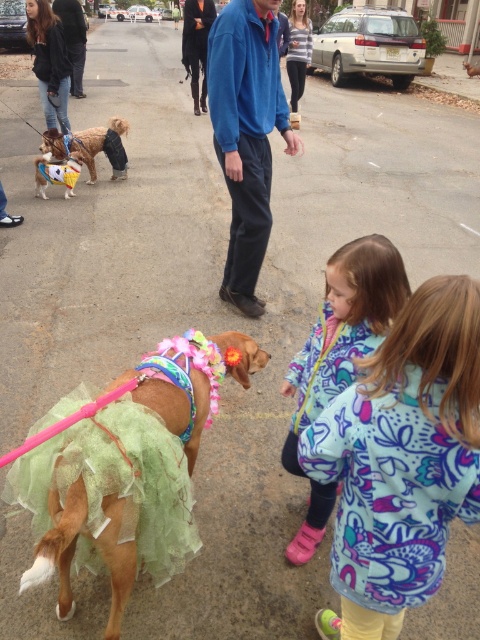
Question: Based on their relative distances, which object is nearer to the shiny gold dog at center?

Choices:
 (A) brown plush dog at left
 (B) striped fabric shirt at center
 (C) printed fleece jacket at lower right

Answer: (A)

Question: Can you confirm if printed fleece jacket at lower right is positioned to the right of fluffy fleece jacket at lower right?

Choices:
 (A) no
 (B) yes

Answer: (B)

Question: Can you confirm if printed fleece jacket at lower right is thinner than shiny green tulle skirt at center?

Choices:
 (A) yes
 (B) no

Answer: (A)

Question: Which object is farther from the camera taking this photo?

Choices:
 (A) printed fleece jacket at lower right
 (B) blue fleece jacket at center
 (C) brown plush dog at left

Answer: (C)

Question: Estimate the real-world distances between objects in this image. Which object is farther from the brown plush dog at left?

Choices:
 (A) shiny gold dog at center
 (B) shiny green tulle skirt at center

Answer: (B)

Question: Does printed fleece jacket at lower right appear on the left side of shiny green tulle skirt at center?

Choices:
 (A) no
 (B) yes

Answer: (A)